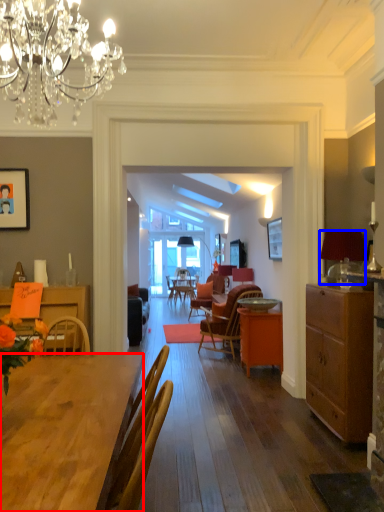
Question: Which object is further to the camera taking this photo, desk (highlighted by a red box) or lamp (highlighted by a blue box)?

Choices:
 (A) desk
 (B) lamp

Answer: (B)